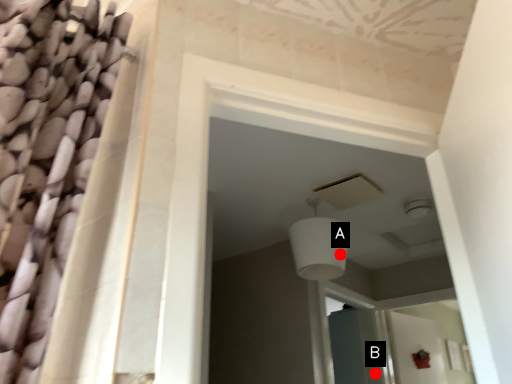
Question: Two points are circled on the image, labeled by A and B beside each circle. Among these points, which one is nearest to the camera?

Choices:
 (A) A is closer
 (B) B is closer

Answer: (A)